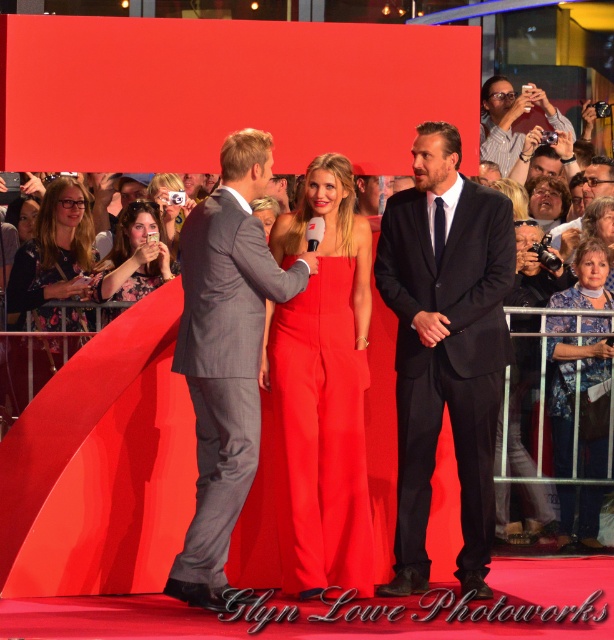
You are standing in the red carpet event and want to take a photo of both point coordinates mentioned. Which point is closer to you, point (x=464, y=561) or point (x=572, y=522)?

Point (x=464, y=561) is closer to the viewer than point (x=572, y=522), so you should focus on that point first to capture both in your photo.

Based on the photo, you are a photographer at the event and want to position a spotlight exactly at the center of the image. The gray pinstripe suit at center is located at point (225, 355). Is the spotlight placement at point 0.5, 0.5 accurate enough to illuminate the gray pinstripe suit at center?

The gray pinstripe suit at center is located at point (225, 355), which is slightly to the right and lower than the exact center point 0.5, 0.5. Therefore, the spotlight placement at point 0.5, 0.5 may not accurately illuminate the gray pinstripe suit at center.

You are a photographer at the event and need to take a photo of the gray pinstripe suit at center and the matte black camera at upper right. Which object will appear larger in the photo?

The gray pinstripe suit at center will appear larger in the photo because it is closer to the viewer than the matte black camera at upper right.